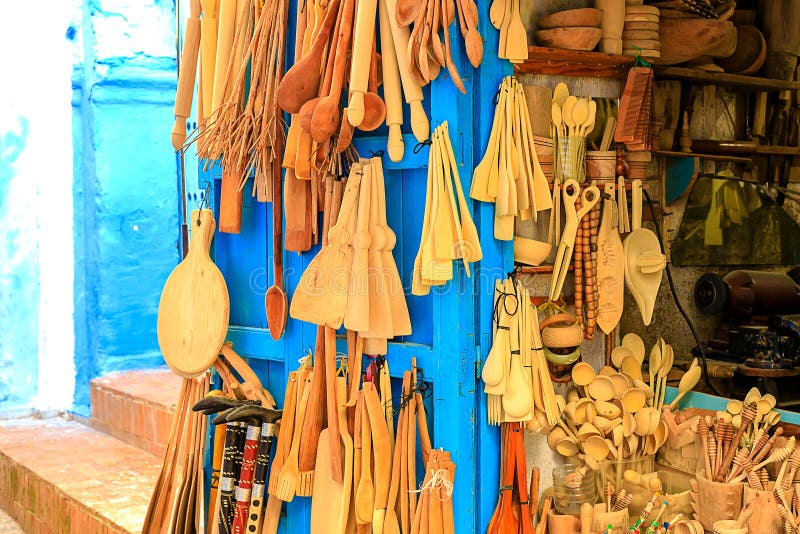
The width and height of the screenshot is (800, 534). I want to click on step/stair, so click(x=161, y=407), click(x=77, y=449).